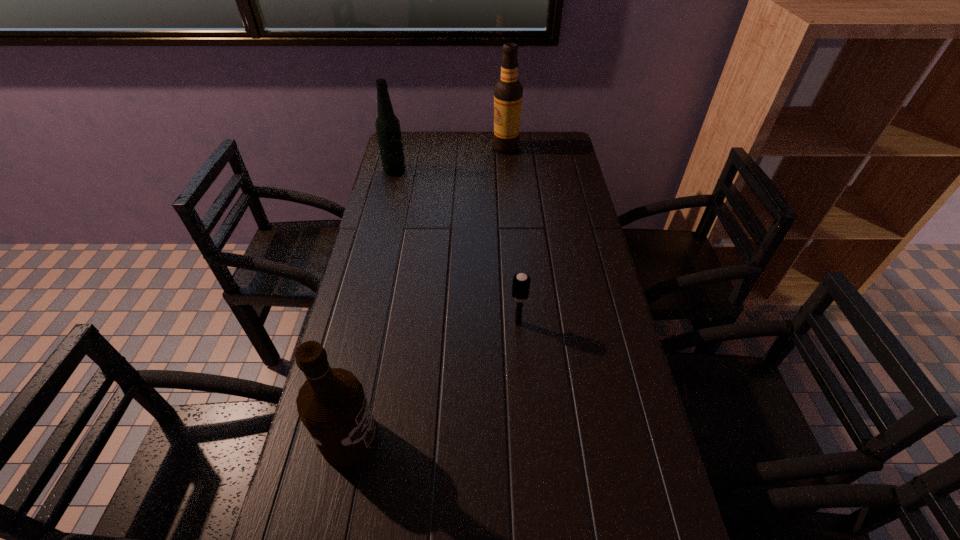
The width and height of the screenshot is (960, 540). I want to click on vacant space located on the label of the nearest alcohol, so 511,438.

What are the coordinates of `free region located on the front of the second nearest object` in the screenshot? It's located at (524, 415).

At what (x,y) coordinates should I click in order to perform the action: click on object that is at the far edge. Please return your answer as a coordinate pair (x, y). The image size is (960, 540). Looking at the image, I should click on (508, 92).

The height and width of the screenshot is (540, 960). I want to click on blank space at the far edge, so click(x=442, y=148).

This screenshot has height=540, width=960. What are the coordinates of `vacant space at the left edge of the desktop` in the screenshot? It's located at (359, 353).

Locate an element on the screen. free region at the right edge of the desktop is located at coordinates (595, 294).

What are the coordinates of `vacant space at the far left corner` in the screenshot? It's located at (408, 146).

Locate an element on the screen. This screenshot has width=960, height=540. vacant space in between the farthest alcohol and the third nearest object is located at coordinates (450, 159).

Locate an element on the screen. free space between the farthest object and the second nearest alcohol is located at coordinates (450, 159).

Locate an element on the screen. This screenshot has width=960, height=540. vacant area between the nearest object and the second farthest object is located at coordinates pyautogui.click(x=372, y=304).